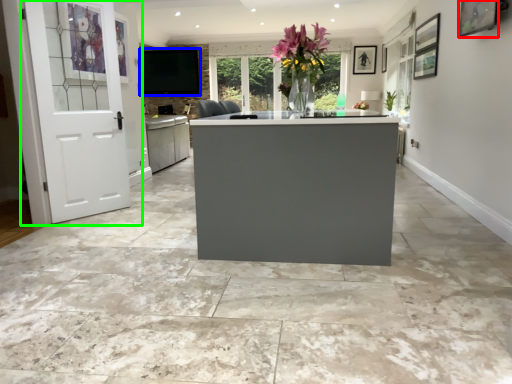
Question: Which is nearer to the picture frame (highlighted by a red box)? window screen (highlighted by a blue box) or door (highlighted by a green box).

Choices:
 (A) window screen
 (B) door

Answer: (B)